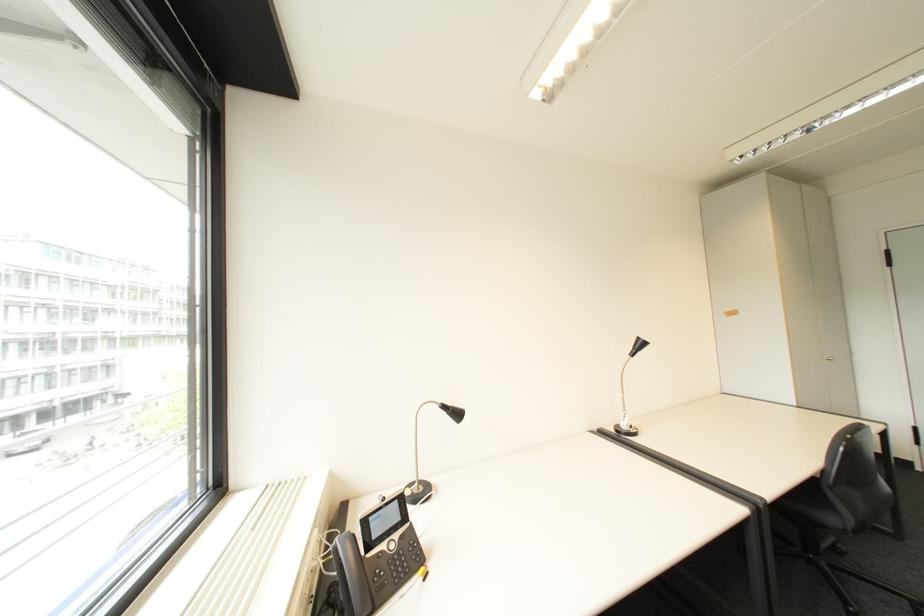
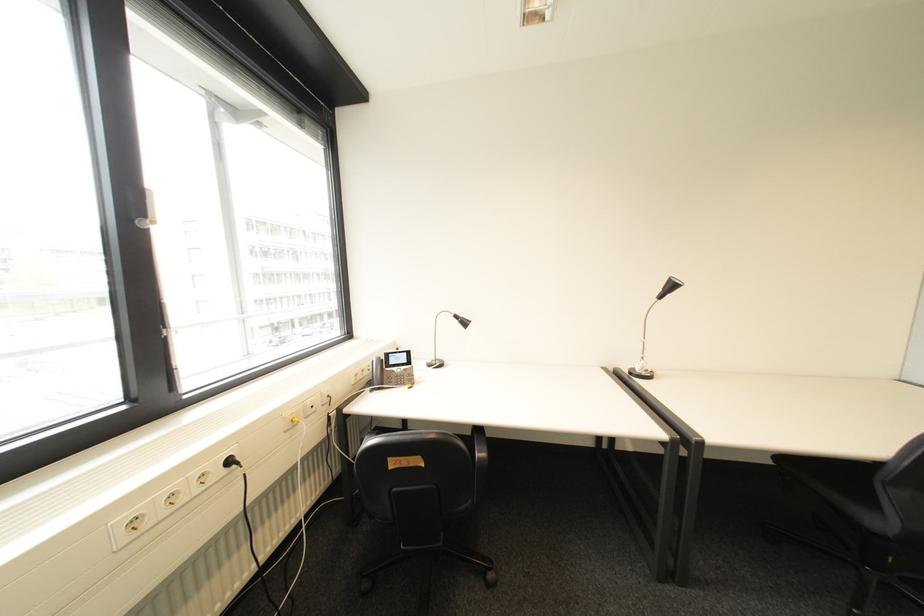
Where in the second image is the point corresponding to [380,556] from the first image?

(396, 370)